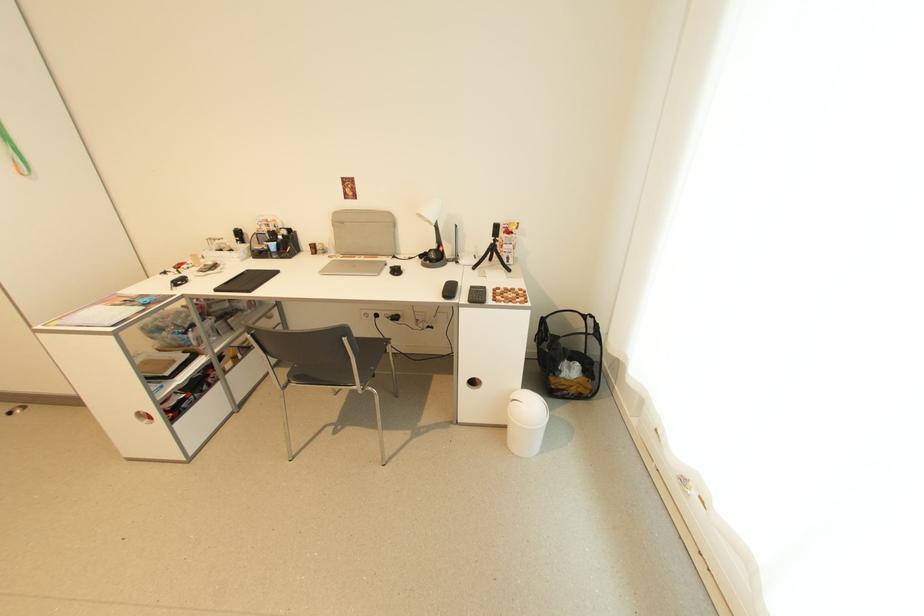
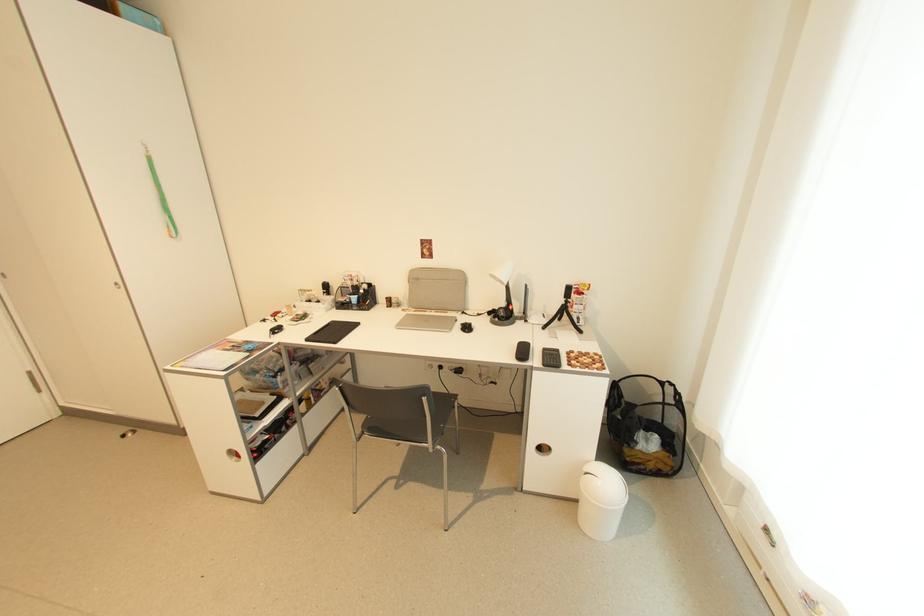
Locate, in the second image, the point that corresponds to [294,383] in the first image.

(368, 434)